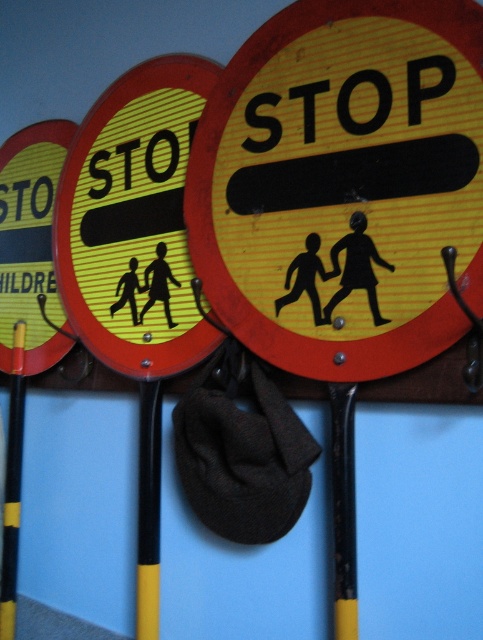
Question: Which of these objects is positioned closest to the yellowmaterial/texturetraffic sign at right?

Choices:
 (A) yellow plastic pole at center
 (B) black plastic pole at center
 (C) yellowmaterial/texturesign at left

Answer: (B)

Question: Which object is the farthest from the yellow/black pole at center?

Choices:
 (A) black plastic pole at center
 (B) yellow plastic pole at center
 (C) yellowmaterial/texturesign at center

Answer: (A)

Question: Can you confirm if yellowmaterial/texturetraffic sign at right is wider than yellowmaterial/texturesign at left?

Choices:
 (A) no
 (B) yes

Answer: (B)

Question: Which of these objects is positioned closest to the yellow plastic pole at center?

Choices:
 (A) yellowmaterial/texturesign at left
 (B) black plastic pole at center
 (C) yellow/black pole at center
 (D) yellowmaterial/texturesign at center

Answer: (D)

Question: Is yellowmaterial/texturesign at center positioned in front of yellow plastic pole at center?

Choices:
 (A) yes
 (B) no

Answer: (A)

Question: Does yellowmaterial/texturetraffic sign at right appear on the right side of yellowmaterial/texturesign at left?

Choices:
 (A) yes
 (B) no

Answer: (A)